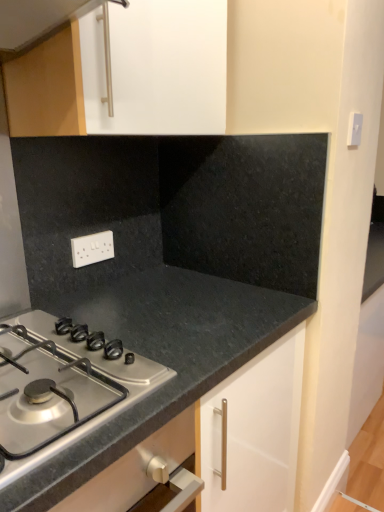
The image size is (384, 512). What are the coordinates of `free space above black granite countertop at center (from a real-world perspective)` in the screenshot? It's located at (192, 300).